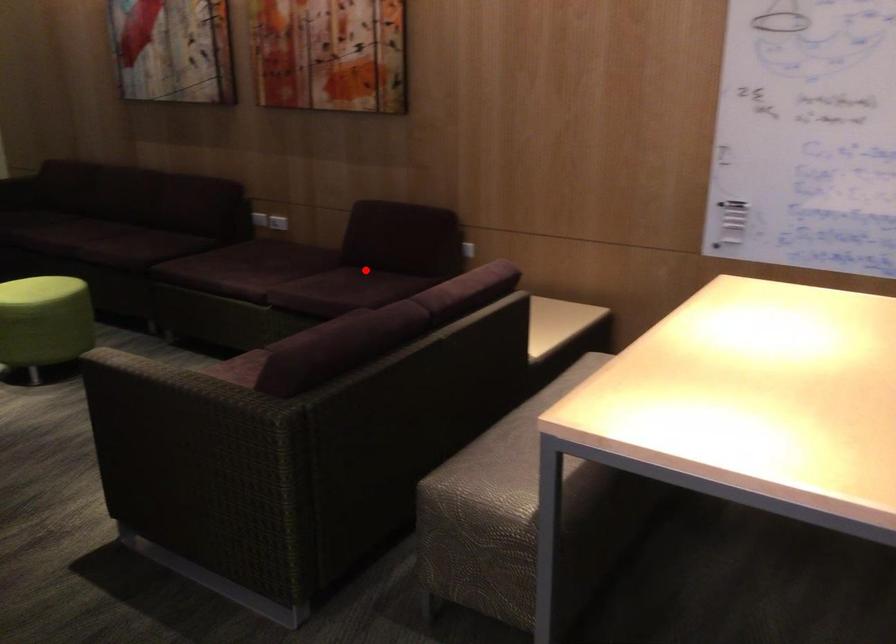
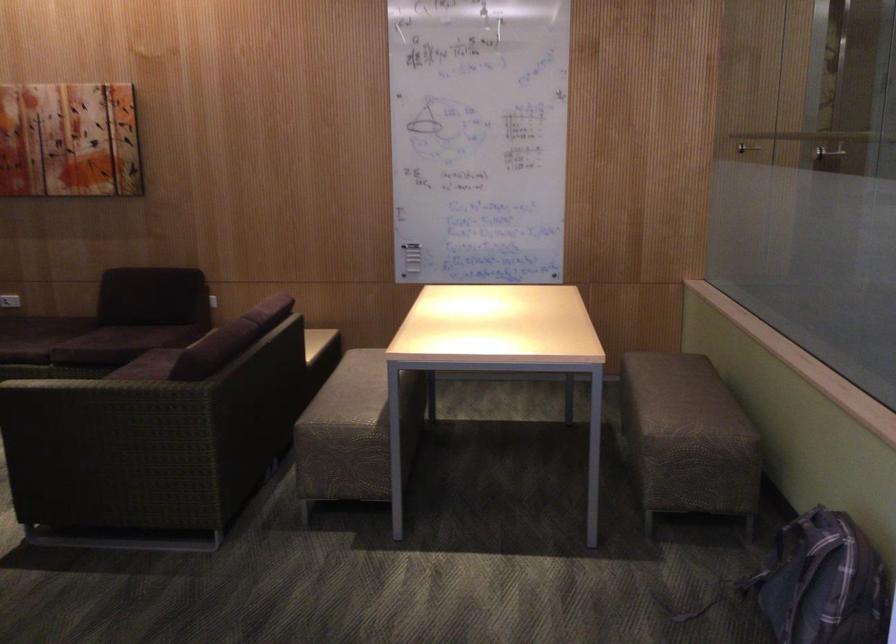
Question: I am providing you with two images of the same scene from different viewpoints. Given a red point in image1, look at the same physical point in image2. Is it:

Choices:
 (A) Closer to the viewpoint
 (B) Farther from the viewpoint

Answer: (B)